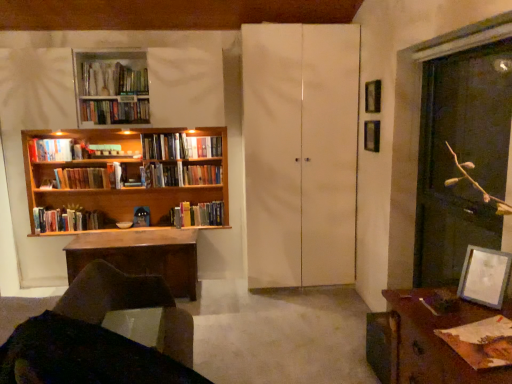
At what (x,y) coordinates should I click in order to perform the action: click on blank space situated above hardcover books at center, the fourth book from the back (from a real-world perspective). Please return your answer as a coordinate pair (x, y). The image size is (512, 384). Looking at the image, I should click on 162,136.